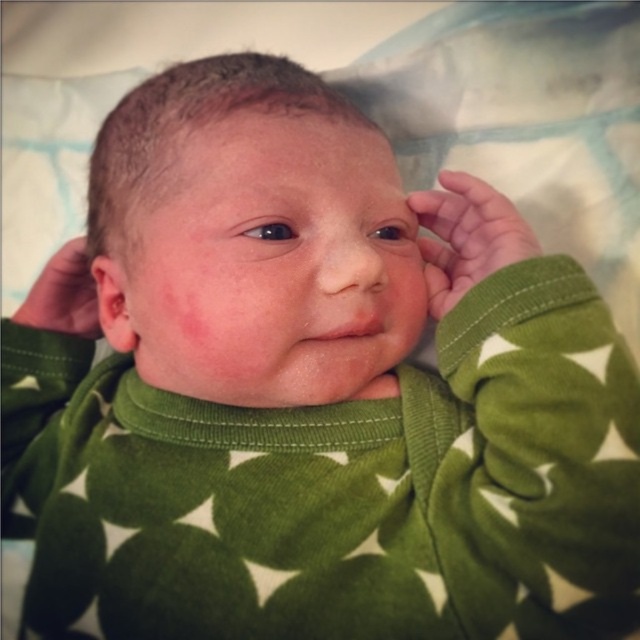
Between green soft fabric hand at upper right and pinkish skin ear at left, which one appears on the left side from the viewer's perspective?

pinkish skin ear at left

Can you confirm if green soft fabric hand at upper right is wider than pinkish skin ear at left?

Yes.

Locate an element on the screen. Image resolution: width=640 pixels, height=640 pixels. green soft fabric hand at upper right is located at coordinates (467, 236).

Does skinny green fabric at left have a greater height compared to pinkish skin ear at left?

Yes, skinny green fabric at left is taller than pinkish skin ear at left.

Does skinny green fabric at left have a smaller size compared to pinkish skin ear at left?

Indeed, skinny green fabric at left has a smaller size compared to pinkish skin ear at left.

Is point (52, 289) farther from camera compared to point (120, 310)?

Yes.

Identify the location of skinny green fabric at left. (64, 294).

Who is higher up, green soft fabric hand at upper right or skinny green fabric at left?

green soft fabric hand at upper right is above.

Consider the image. Who is lower down, green soft fabric hand at upper right or skinny green fabric at left?

skinny green fabric at left is below.

Does point (454, 262) lie behind point (38, 275)?

No, (454, 262) is closer to viewer.

Locate an element on the screen. The image size is (640, 640). green soft fabric hand at upper right is located at coordinates (467, 236).